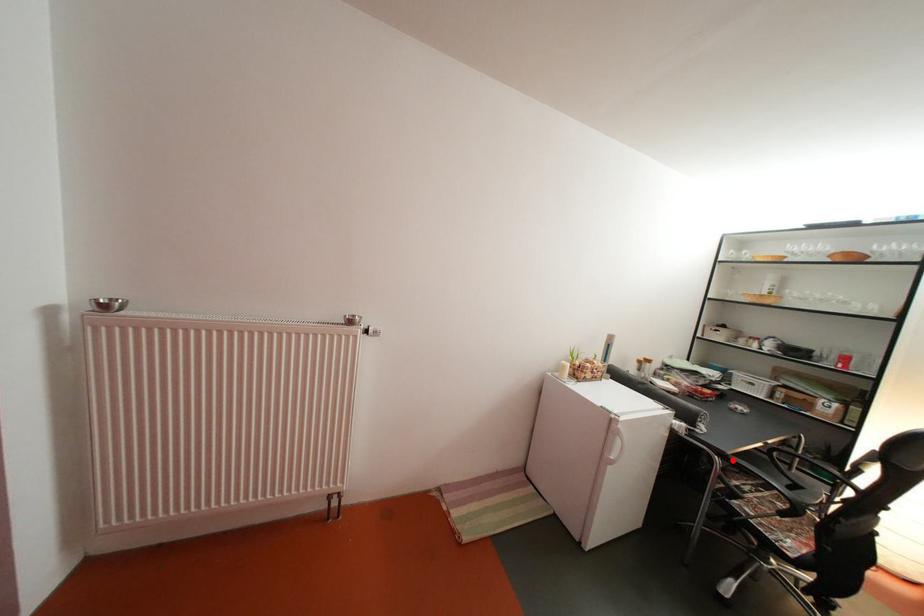
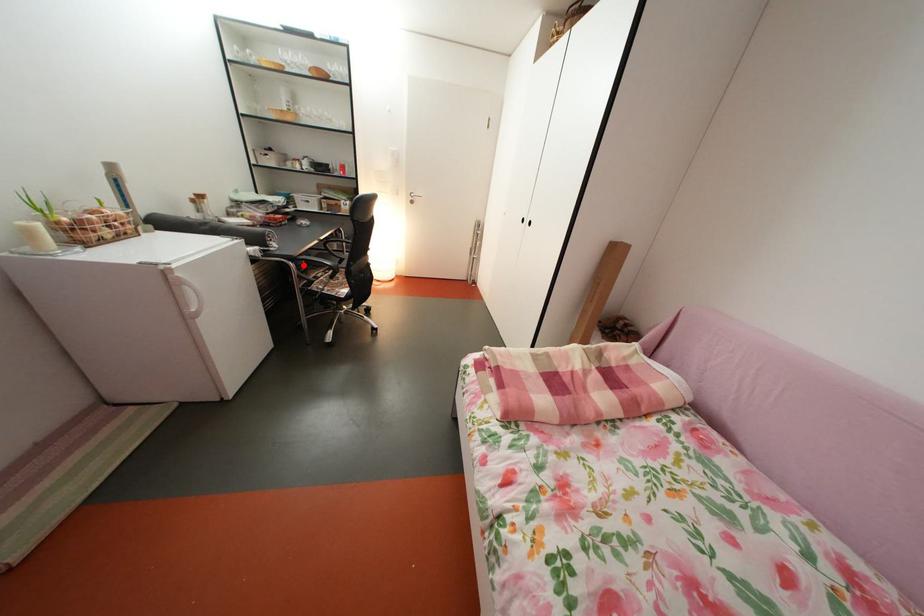
I am providing you with two images of the same scene from different viewpoints. A red point is marked on the first image and another point is marked on the second image. Is the marked point in image1 the same physical position as the marked point in image2?

Yes